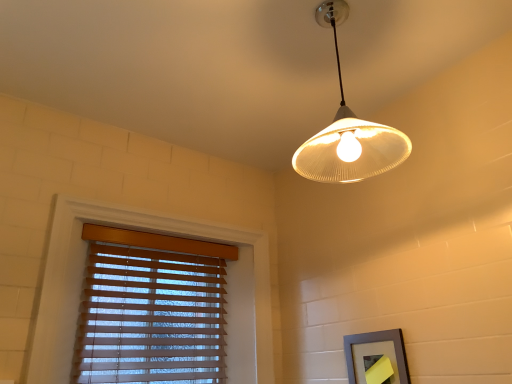
Question: Is white ribbed glass lampshade at upper center to the right of gray matte picture frame at lower right from the viewer's perspective?

Choices:
 (A) yes
 (B) no

Answer: (B)

Question: Is white ribbed glass lampshade at upper center positioned far away from gray matte picture frame at lower right?

Choices:
 (A) yes
 (B) no

Answer: (B)

Question: From the image's perspective, is white ribbed glass lampshade at upper center below gray matte picture frame at lower right?

Choices:
 (A) no
 (B) yes

Answer: (A)

Question: Is white ribbed glass lampshade at upper center with gray matte picture frame at lower right?

Choices:
 (A) yes
 (B) no

Answer: (B)

Question: From the image's perspective, is white ribbed glass lampshade at upper center over gray matte picture frame at lower right?

Choices:
 (A) no
 (B) yes

Answer: (B)

Question: From the image's perspective, is white ribbed glass lampshade at upper center located above or below gray matte picture frame at lower right?

Choices:
 (A) below
 (B) above

Answer: (B)

Question: Looking at their shapes, would you say white ribbed glass lampshade at upper center is wider or thinner than gray matte picture frame at lower right?

Choices:
 (A) thin
 (B) wide

Answer: (B)

Question: Considering their positions, is white ribbed glass lampshade at upper center located in front of or behind gray matte picture frame at lower right?

Choices:
 (A) front
 (B) behind

Answer: (A)

Question: Does point (333, 145) appear closer or farther from the camera than point (392, 350)?

Choices:
 (A) closer
 (B) farther

Answer: (A)

Question: Is point (357, 162) closer or farther from the camera than point (118, 269)?

Choices:
 (A) farther
 (B) closer

Answer: (B)

Question: From the image's perspective, is white ribbed glass lampshade at upper center located above or below wooden blinds at lower left?

Choices:
 (A) above
 (B) below

Answer: (A)

Question: Considering their positions, is white ribbed glass lampshade at upper center located in front of or behind wooden blinds at lower left?

Choices:
 (A) front
 (B) behind

Answer: (A)

Question: Based on their positions, is white ribbed glass lampshade at upper center located to the left or right of wooden blinds at lower left?

Choices:
 (A) right
 (B) left

Answer: (A)

Question: Considering the positions of wooden blinds at lower left and gray matte picture frame at lower right in the image, is wooden blinds at lower left taller or shorter than gray matte picture frame at lower right?

Choices:
 (A) tall
 (B) short

Answer: (A)

Question: Considering the positions of point (x=80, y=370) and point (x=389, y=380), is point (x=80, y=370) closer or farther from the camera than point (x=389, y=380)?

Choices:
 (A) farther
 (B) closer

Answer: (A)